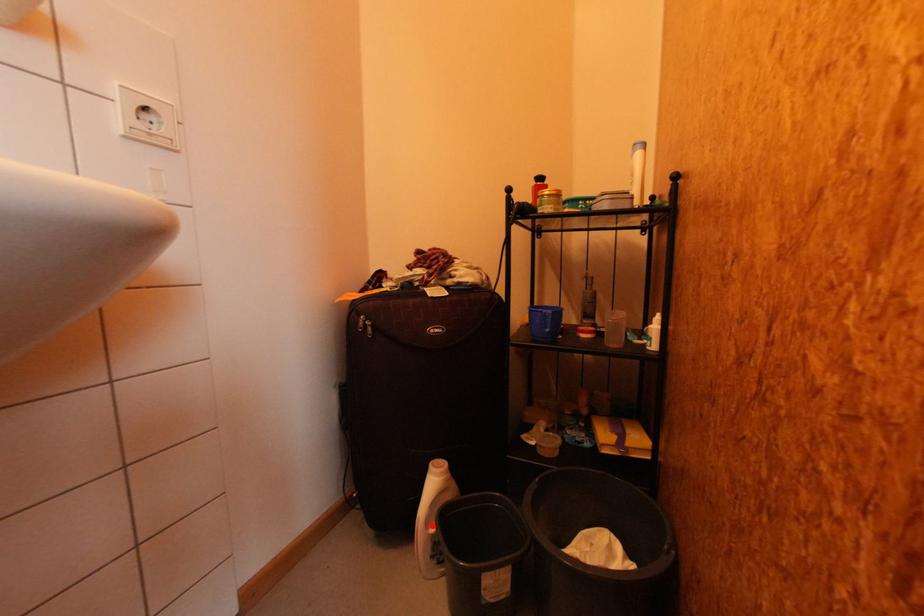
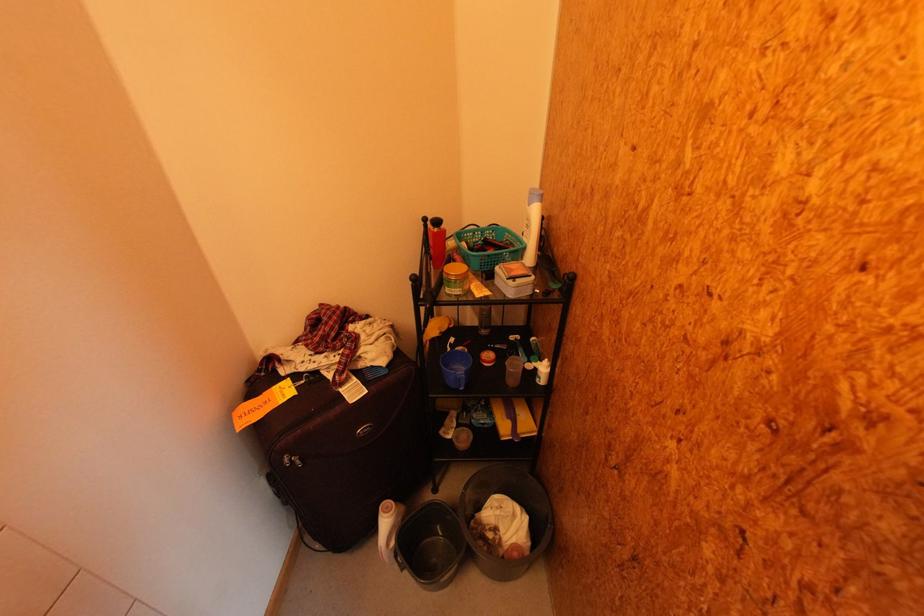
Question: I am providing you with two images of the same scene from different viewpoints. In image1, a red point is highlighted. Considering the same 3D point in image2, which of the following is correct?

Choices:
 (A) It is closer
 (B) It is farther

Answer: (B)